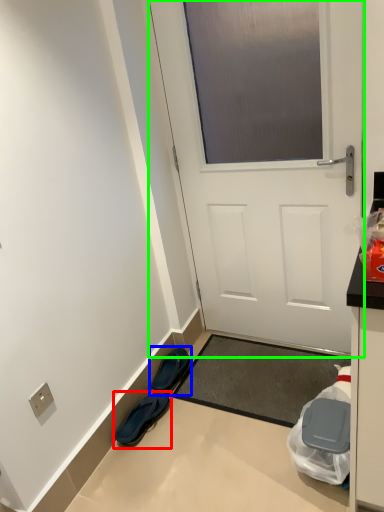
Question: Estimate the real-world distances between objects in this image. Which object is farther from footwear (highlighted by a red box), footwear (highlighted by a blue box) or door (highlighted by a green box)?

Choices:
 (A) footwear
 (B) door

Answer: (B)